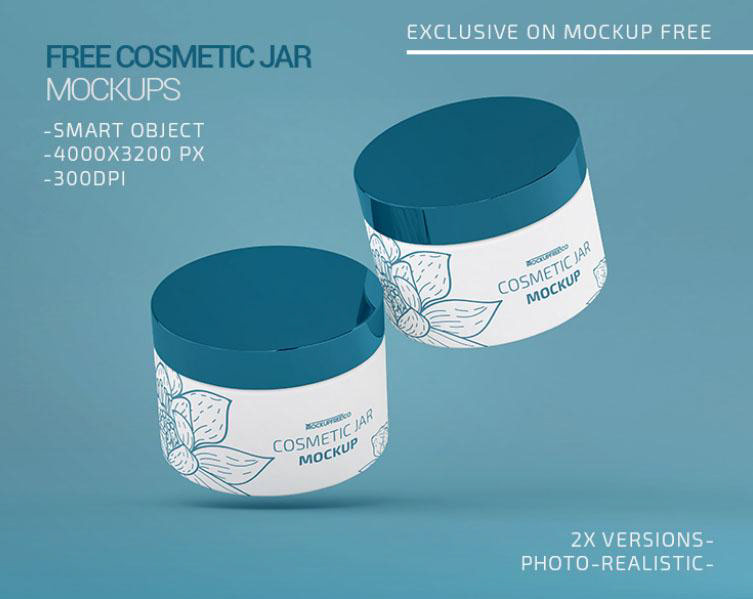
You are a GUI agent. You are given a task and a screenshot of the screen. Output one action in this format:
    pyautogui.click(x=<x>, y=<y>)
    Task: Click on the cosmetic jars
    
    Given the screenshot: What is the action you would take?
    pyautogui.click(x=346, y=409), pyautogui.click(x=483, y=278)